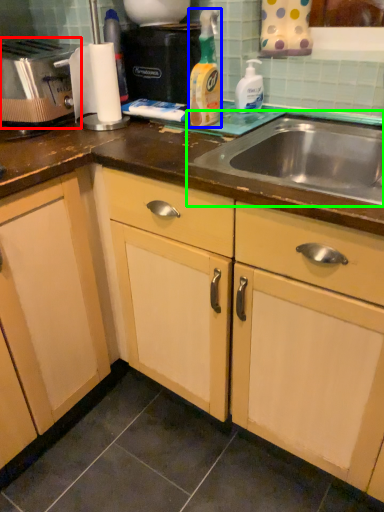
Question: Which object is positioned closest to toaster (highlighted by a red box)? Select from cleaning product (highlighted by a blue box) and sink (highlighted by a green box).

Choices:
 (A) cleaning product
 (B) sink

Answer: (A)